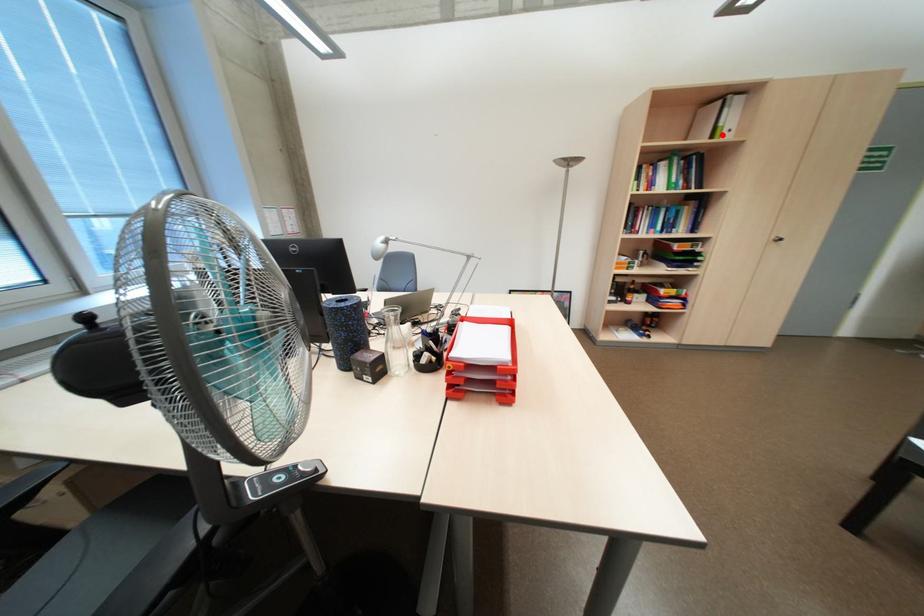
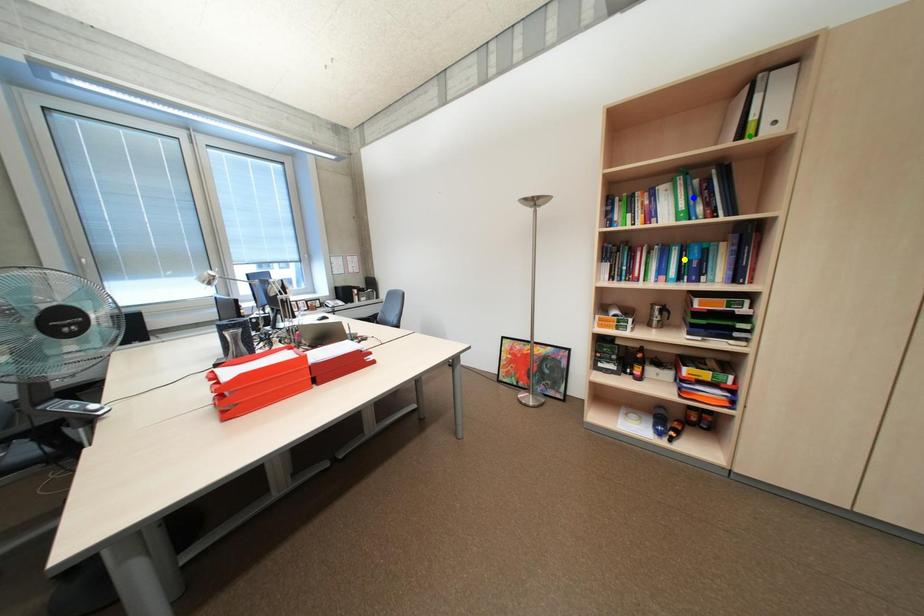
Question: I am providing you with two images of the same scene from different viewpoints. A red point is marked on the first image. You are given multiple points on the second image. In image 2, which mark is for the same physical point as the one in image 1?

Choices:
 (A) blue point
 (B) yellow point
 (C) green point

Answer: (C)